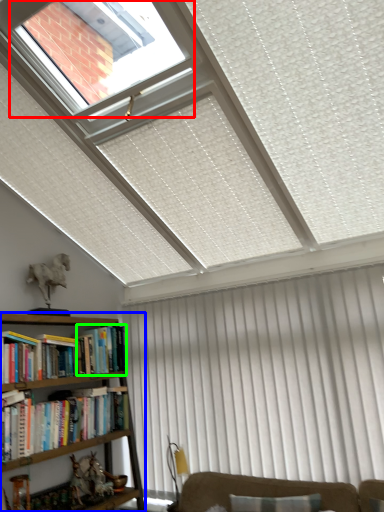
Question: Considering the real-world distances, which object is closest to bay window (highlighted by a red box)? bookcase (highlighted by a blue box) or book (highlighted by a green box).

Choices:
 (A) bookcase
 (B) book

Answer: (B)